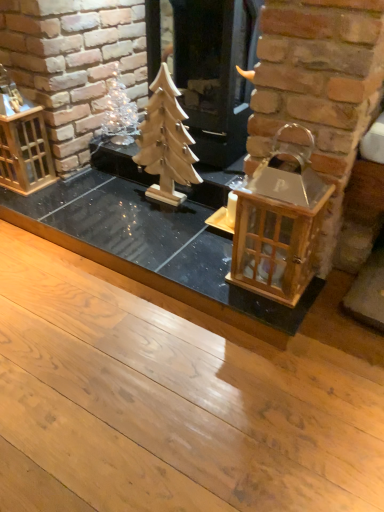
Question: Considering the relative sizes of wooden christmas tree at center and wooden lantern at right in the image provided, is wooden christmas tree at center thinner than wooden lantern at right?

Choices:
 (A) no
 (B) yes

Answer: (B)

Question: Can you confirm if wooden christmas tree at center is bigger than wooden lantern at right?

Choices:
 (A) yes
 (B) no

Answer: (B)

Question: Can you confirm if wooden christmas tree at center is smaller than wooden lantern at right?

Choices:
 (A) yes
 (B) no

Answer: (A)

Question: Is wooden christmas tree at center positioned far away from wooden lantern at right?

Choices:
 (A) no
 (B) yes

Answer: (A)

Question: Is wooden christmas tree at center oriented towards wooden lantern at right?

Choices:
 (A) yes
 (B) no

Answer: (B)

Question: Looking at the image, does wooden christmas tree at center seem bigger or smaller compared to clear glass ornament at upper left?

Choices:
 (A) big
 (B) small

Answer: (A)

Question: From the image's perspective, is wooden christmas tree at center positioned above or below clear glass ornament at upper left?

Choices:
 (A) above
 (B) below

Answer: (B)

Question: In terms of width, does wooden christmas tree at center look wider or thinner when compared to clear glass ornament at upper left?

Choices:
 (A) wide
 (B) thin

Answer: (B)

Question: Does point (167, 74) appear closer or farther from the camera than point (129, 103)?

Choices:
 (A) closer
 (B) farther

Answer: (A)

Question: Is wooden lantern at left to the left or to the right of wooden christmas tree at center in the image?

Choices:
 (A) left
 (B) right

Answer: (A)

Question: Is wooden lantern at left taller or shorter than wooden christmas tree at center?

Choices:
 (A) tall
 (B) short

Answer: (B)

Question: Is wooden lantern at left bigger or smaller than wooden christmas tree at center?

Choices:
 (A) big
 (B) small

Answer: (A)

Question: From the image's perspective, is wooden lantern at left above or below wooden christmas tree at center?

Choices:
 (A) below
 (B) above

Answer: (B)

Question: From a real-world perspective, is wooden lantern at right above or below wooden christmas tree at center?

Choices:
 (A) above
 (B) below

Answer: (B)

Question: From the image's perspective, is wooden lantern at right positioned above or below wooden christmas tree at center?

Choices:
 (A) above
 (B) below

Answer: (B)